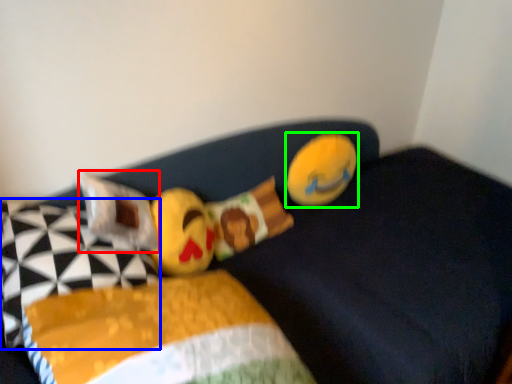
Question: Which is farther away from pillow (highlighted by a red box)? pillow (highlighted by a blue box) or toy (highlighted by a green box)?

Choices:
 (A) pillow
 (B) toy

Answer: (B)